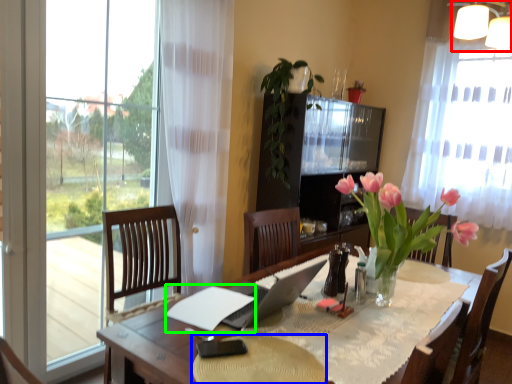
Question: Which object is positioned farthest from lamp (highlighted by a red box)? Select from flat (highlighted by a blue box) and notepad (highlighted by a green box).

Choices:
 (A) flat
 (B) notepad

Answer: (A)